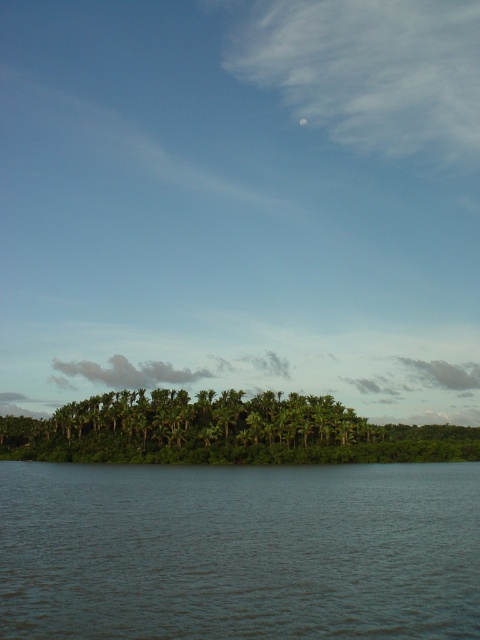
You are planning to take a photo of the dark blue water at lower center and the green leafy trees at center. Which object should you focus on first if you want to capture both in a single frame without moving the camera?

The dark blue water at lower center is bigger than the green leafy trees at center, so you should focus on the dark blue water at lower center first to ensure it fills the frame appropriately before adjusting for the smaller green leafy trees at center.

You are a small boat that is 5 meters long. You are currently floating on the dark blue water at lower center and want to reach the green leafy trees at center. Can you safely navigate to the trees without running aground?

The dark blue water at lower center and green leafy trees at center are 45.19 meters apart from each other. Since your boat is only 5 meters long, you have enough space to navigate safely to the trees without any issues.